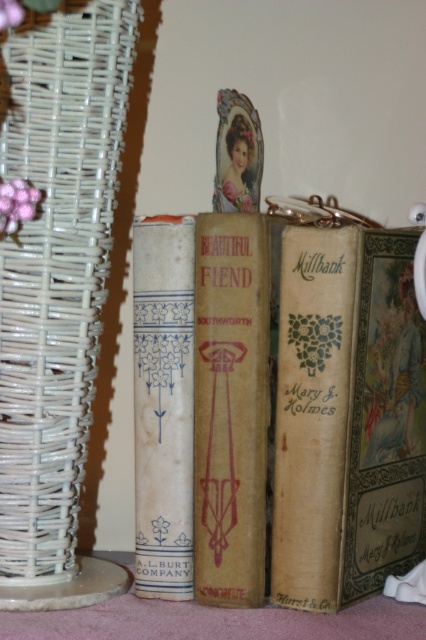
Question: Can you confirm if brown leather book at center is positioned to the left of matte brown book at center?

Choices:
 (A) yes
 (B) no

Answer: (B)

Question: Which of these objects is positioned farthest from the matte brown book at center?

Choices:
 (A) white wicker basket at left
 (B) brown leather book at center
 (C) blue paper book at center

Answer: (A)

Question: In this image, where is white wicker basket at left located relative to blue paper book at center?

Choices:
 (A) right
 (B) left

Answer: (B)

Question: Which of the following is the closest to the observer?

Choices:
 (A) (135, 477)
 (B) (54, 230)

Answer: (B)

Question: Which of these objects is positioned farthest from the blue paper book at center?

Choices:
 (A) matte brown book at center
 (B) white wicker basket at left
 (C) brown leather book at center

Answer: (C)

Question: Does white wicker basket at left appear over blue paper book at center?

Choices:
 (A) no
 (B) yes

Answer: (B)